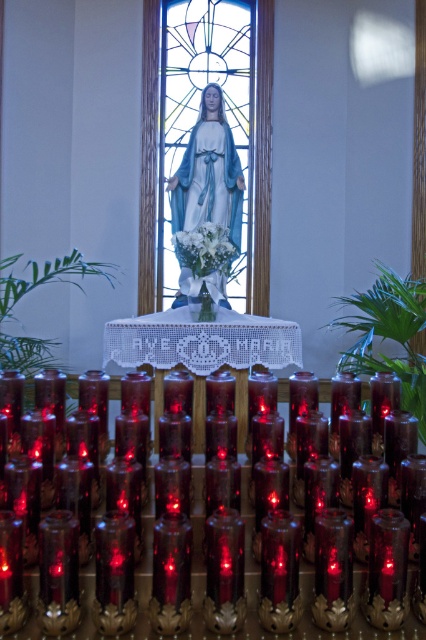
You are a visitor in the church and want to light the translucent glass candle at lower center. Can you light it without touching the stained glass window at center?

The stained glass window at center is positioned over the translucent glass candle at lower center, so you can light the candle without touching the window as it is above it.

You are an art student analyzing the composition of this religious scene. Based on their positions, which object is closer to you when standing in front of the stained glass window at center and the translucent glass candle at lower center?

The stained glass window at center is closer to you than the translucent glass candle at lower center because it is positioned further to the viewer.